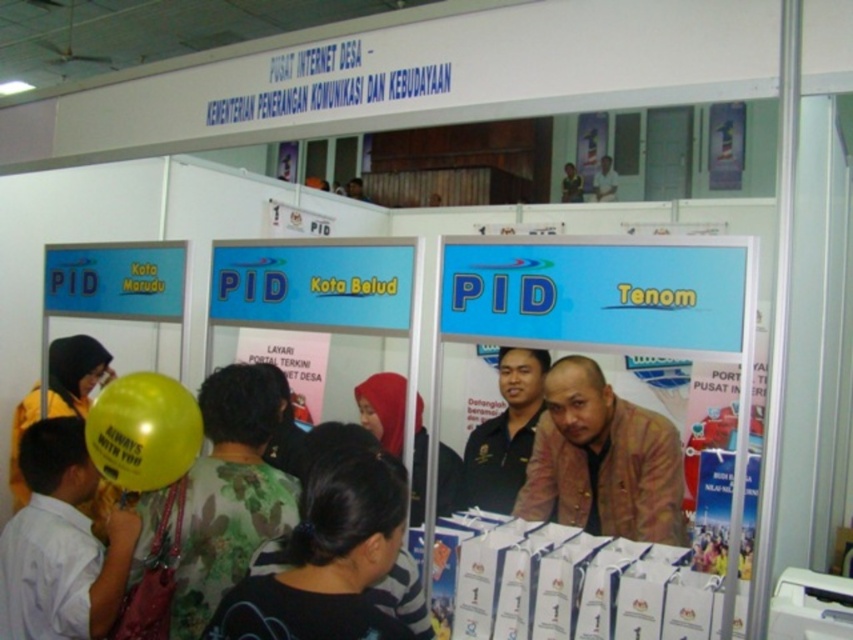
You are standing in front of the PID booth at the exhibition. There are two points marked on the booth, one at coordinate point [283,580] and another at point [401,445]. Which point is closer to you?

Point [283,580] is closer to the viewer than point [401,445].

You are an attendee at the exhibition and want to check if your backpack can fit between the brown leather jacket at lower right and the light brown leather jacket at upper center. The backpack is 1.2 meters wide. Can you fit it there?

The brown leather jacket at lower right might be wider than light brown leather jacket at upper center, so the space between them may be too narrow for a backpack that is 1.2 meters wide. It is uncertain and you should check the actual distance.